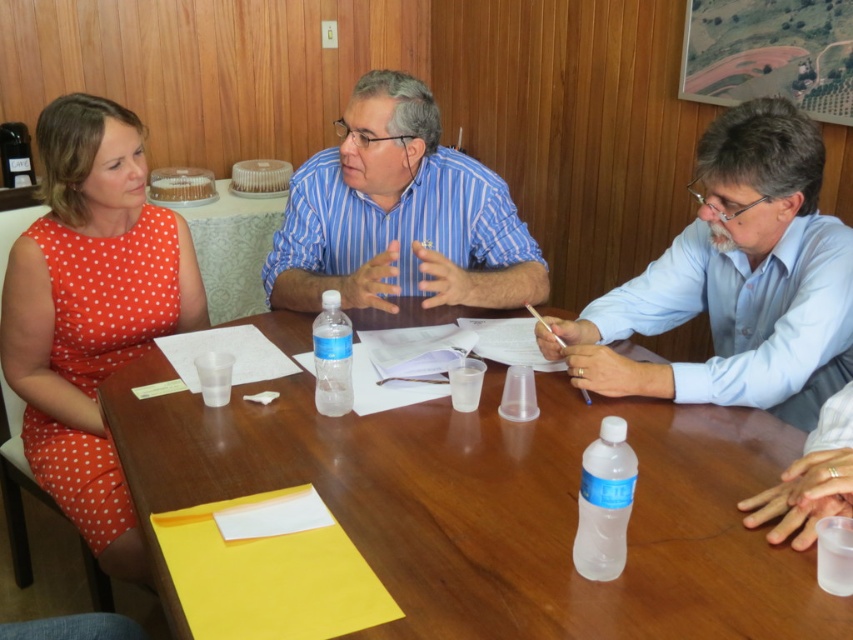
You are standing at the entrance of the room and see the blue smooth shirt at right. Can you estimate its position relative to the center of the room?

The blue smooth shirt at right is located at point 0.439 on the x axis and 0.865 on the y axis, which means it is positioned to the right and slightly below the center of the room.

You are organizing a photoshoot and need to place two mannequins wearing the blue smooth shirt at right and orange polka dot dress at left in a row. If the total space available is 1.5 meters, can both fit side by side without overlapping?

The blue smooth shirt at right is wider than the orange polka dot dress at left. If the total space available is 1.5 meters, both can fit side by side as long as their combined widths do not exceed 1.5 meters. However, since the exact widths are not provided, we cannot confirm definitively.